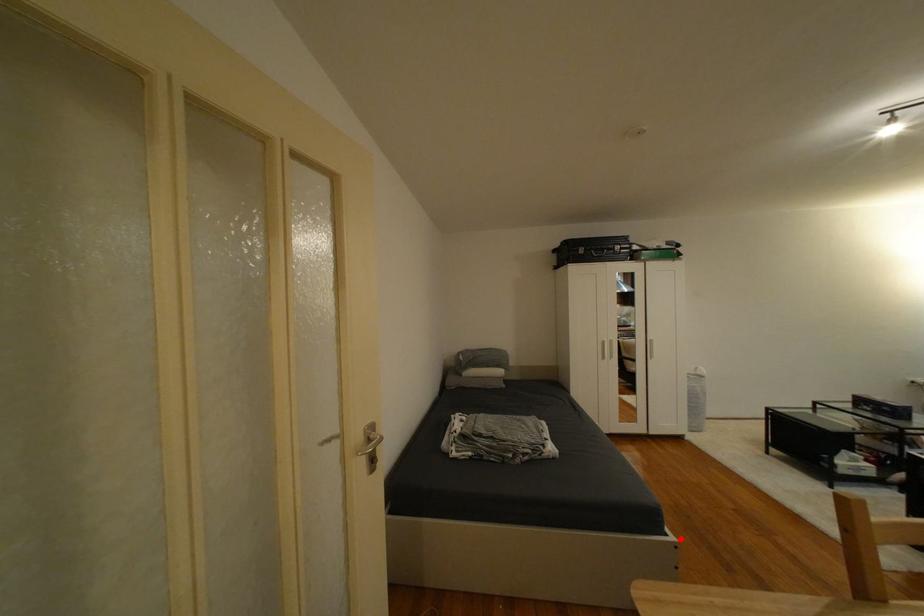
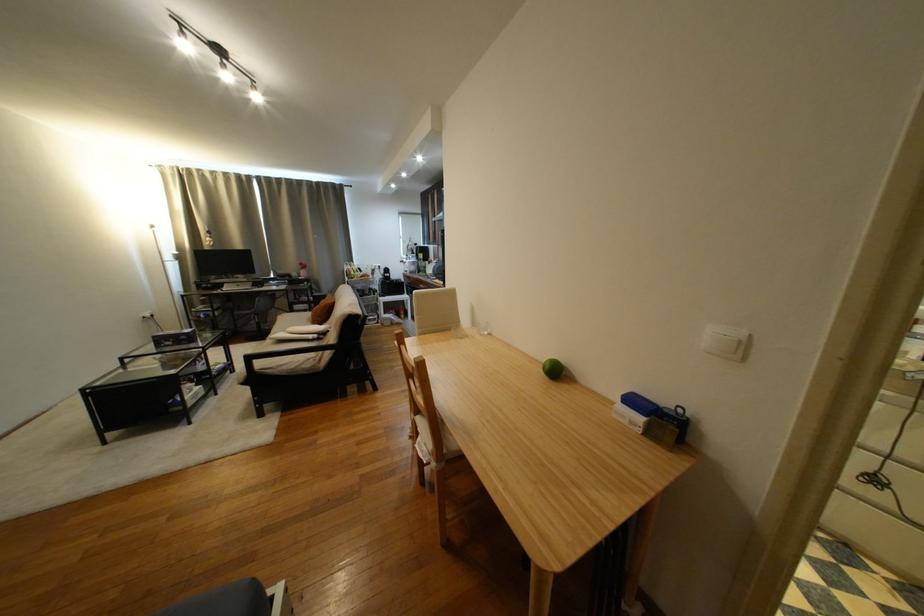
Locate, in the second image, the point that corresponds to the highlighted location in the first image.

(286, 592)